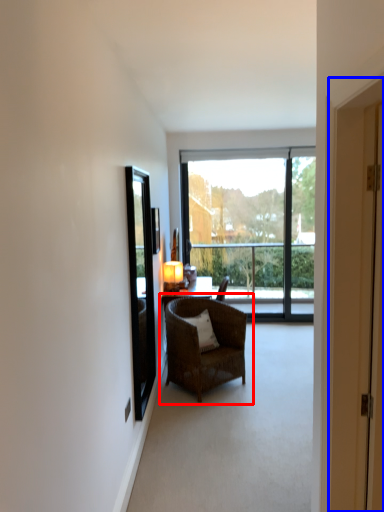
Question: Which object appears farthest to the camera in this image, chair (highlighted by a red box) or door (highlighted by a blue box)?

Choices:
 (A) chair
 (B) door

Answer: (A)